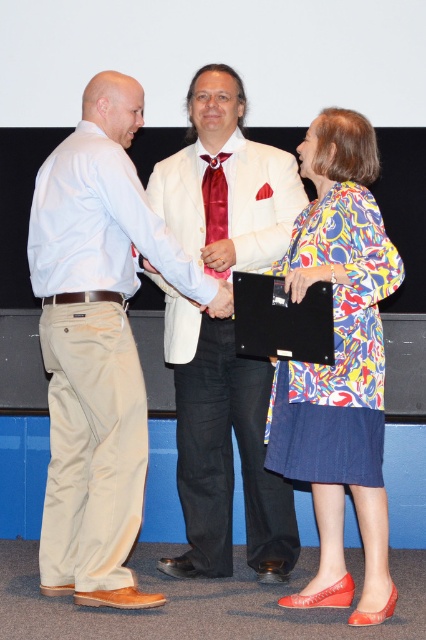
Based on the coordinates provided, which object is located at point (222, 451)?

The object located at point (222, 451) is the white satin suit at center.

You are a photographer positioned behind the three men. You need to adjust your camera to focus on the white satin suit at center and the satin red tie at center. Which object should you adjust the focus for first if you want to capture both clearly in one shot?

The white satin suit at center is much taller than the satin red tie at center, so you should focus on the white satin suit at center first to ensure both are in clear focus.